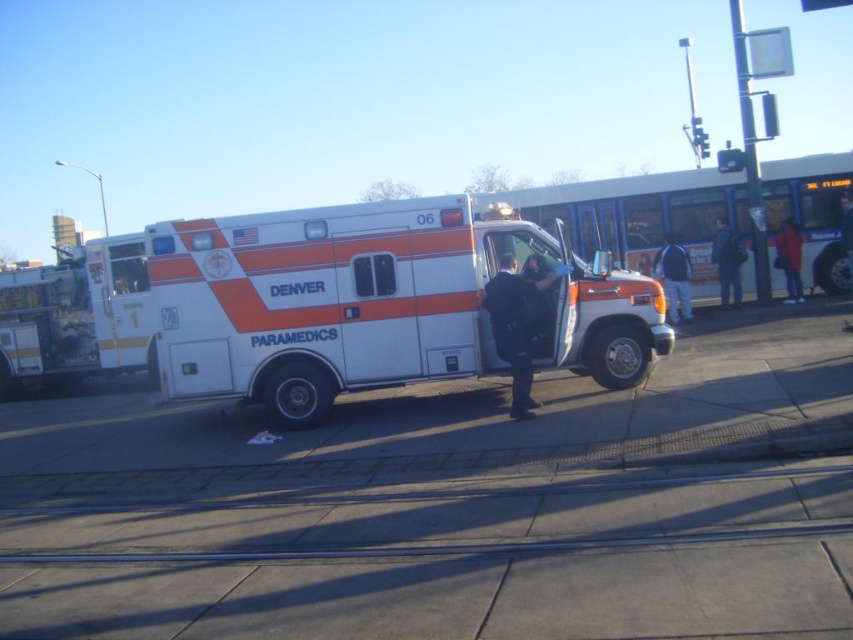
You are a pedestrian at the bus stop and want to walk from point [734,301] to point [793,246]. Which direction should you move relative to the ambulance?

You should move away from the ambulance because point [734,301] is closer to you than point [793,246], which is farther away.